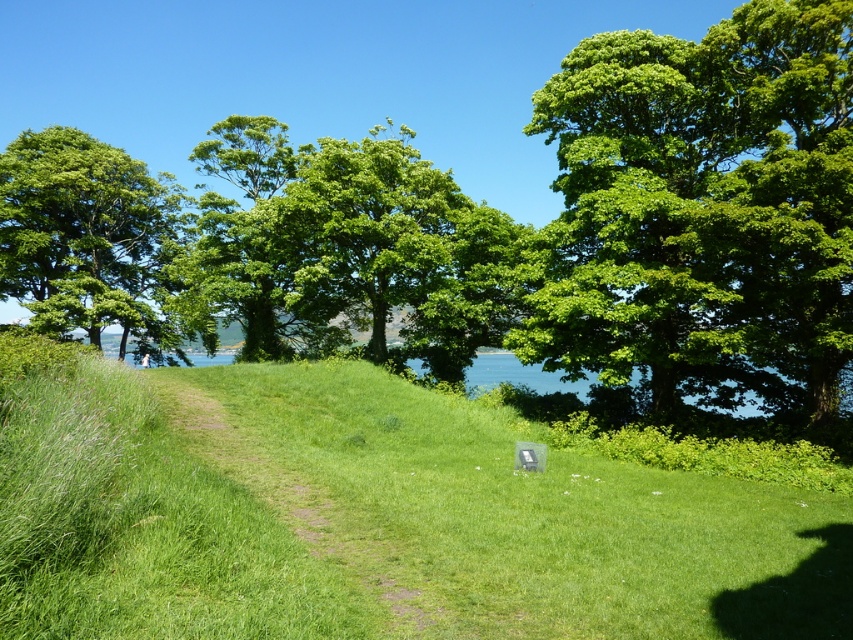
Looking at this image, you are a hiker standing at the starting point of the dirt path. You want to reach the water in the distance. According to the image, where should you walk relative to the green grassy trail at center?

The green grassy trail at center is located at point (321, 474), so you should walk towards that direction to reach the water in the distance.

You are a hiker carrying a 1.5 meter long backpack. You want to walk along the green grassy trail at center. Is there enough space for your backpack to fit along the trail?

The distance between the green grassy trail at center and the viewer is 4.83 meters. Since the backpack is only 1.5 meters long, there is sufficient space for the backpack to fit along the trail.

You are planning to walk along the green grassy trail at center and pass by the green leafy tree at left. Considering their widths, which one do you think you can walk across more comfortably?

The green grassy trail at center has a lesser width compared to green leafy tree at left. Since the trail is narrower, you might find it more challenging to walk across comfortably compared to the wider area around the green leafy tree at left.